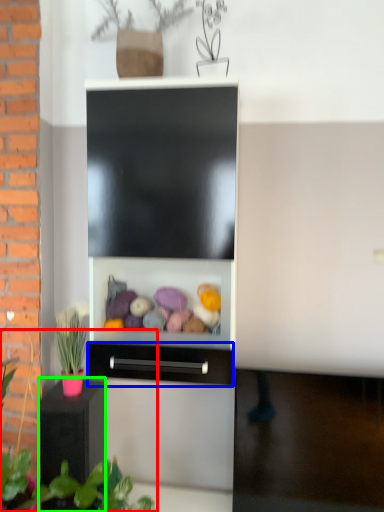
Question: Which object is the closest to the plant (highlighted by a red box)? Choose among these: drawer (highlighted by a blue box) or furniture (highlighted by a green box).

Choices:
 (A) drawer
 (B) furniture

Answer: (B)